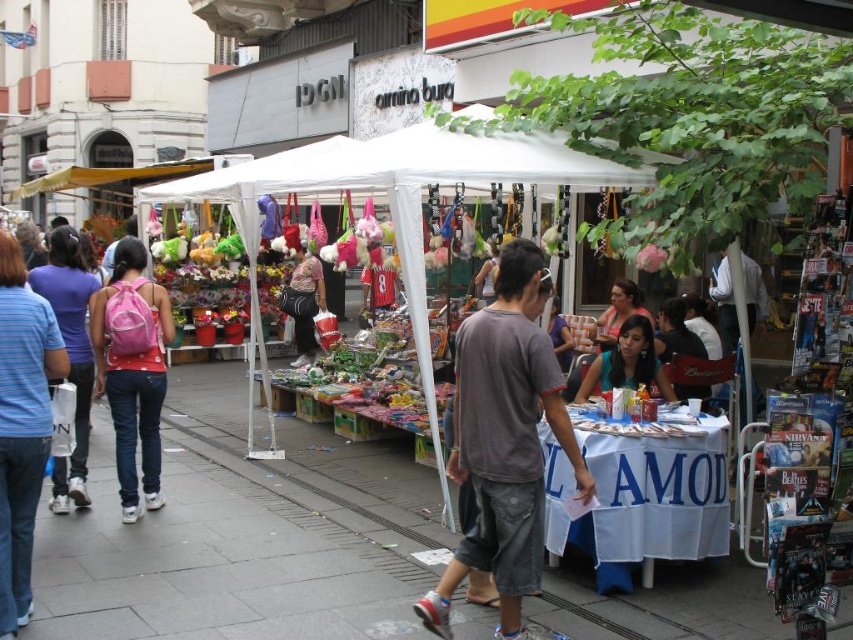
You are a customer at the market and want to buy both the teal satin blouse at center and the pink backpack at center. Which item takes up more space on the vendor table?

The pink backpack at center takes up more space than the teal satin blouse at center because the teal satin blouse at center is smaller than the pink backpack at center.

You are a photographer standing at the entrance of the market. You want to take a photo of the blue striped shirt at left and the gray concrete sidewalk at center. Which object is closer to you?

The gray concrete sidewalk at center is closer to you because the blue striped shirt at left is behind it.